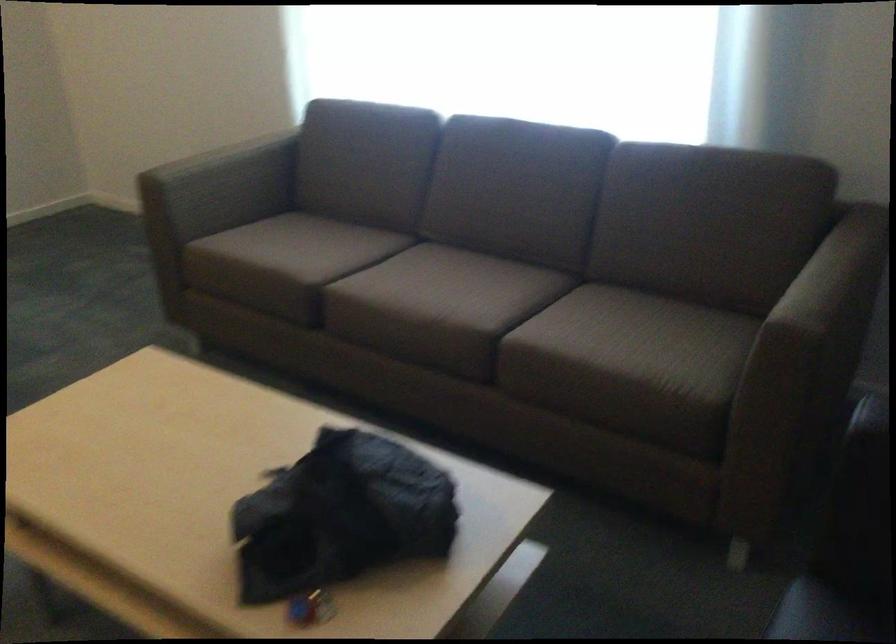
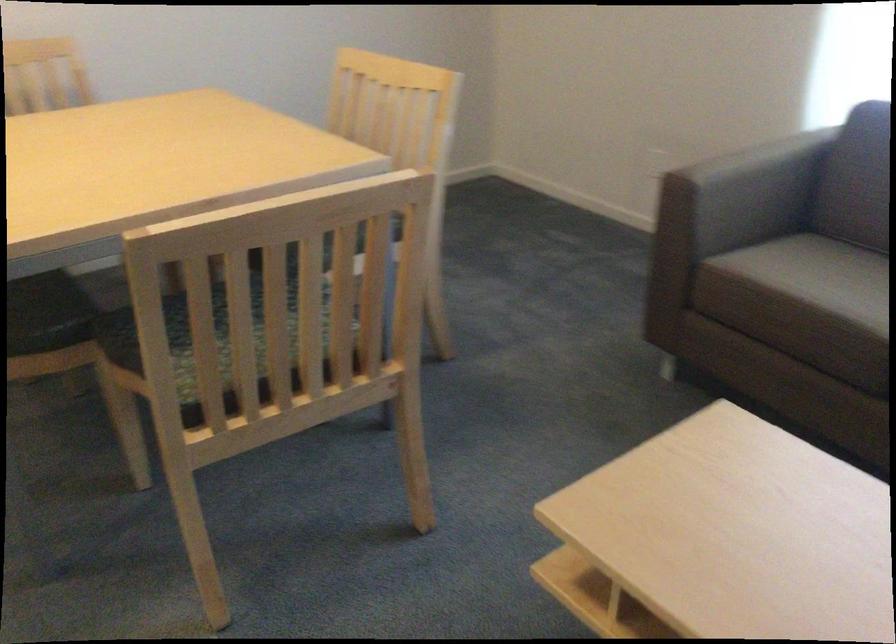
Question: The camera is either moving clockwise (left) or counter-clockwise (right) around the object. The first image is from the beginning of the video and the second image is from the end. Is the camera moving left or right when shooting the video?

Choices:
 (A) Left
 (B) Right

Answer: (B)